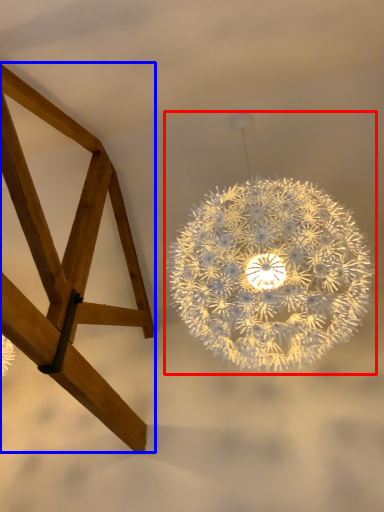
Question: Which object appears farthest to the camera in this image, lamp (highlighted by a red box) or furniture (highlighted by a blue box)?

Choices:
 (A) lamp
 (B) furniture

Answer: (A)